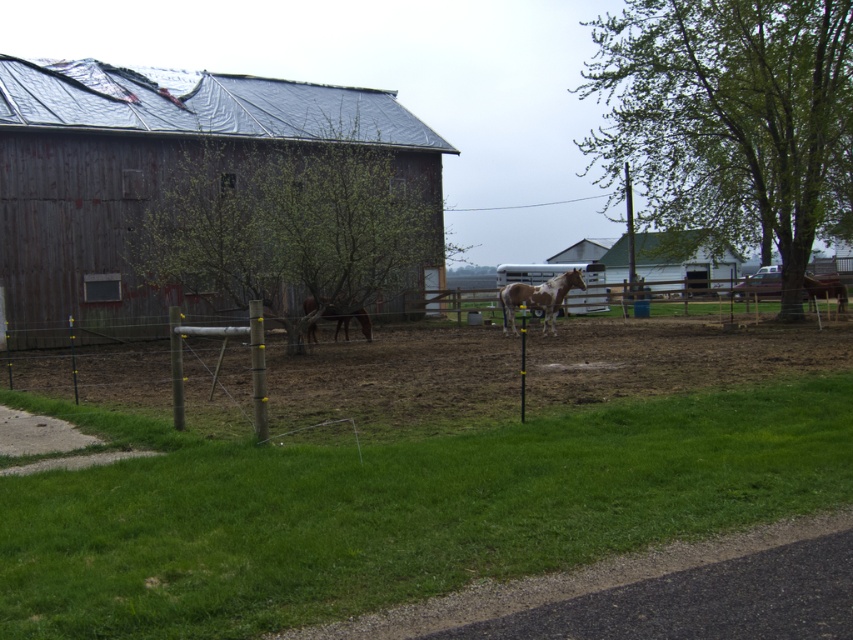
You are a farmer standing at the edge of the paddock near the wooden fence at center. You need to throw a hay bale to the brown glossy horse at center. Can you reach the horse with a throw of 8 meters?

The distance between the wooden fence at center and the brown glossy horse at center is 7.65 meters. Since your throw can reach 8 meters, you can successfully throw the hay bale to the brown glossy horse at center.

You are standing in the farm scene and want to know how far the point at coordinates (x=91, y=67) is from you. Can you determine the distance?

The point at coordinates (x=91, y=67) is 110.36 feet away from the viewer.